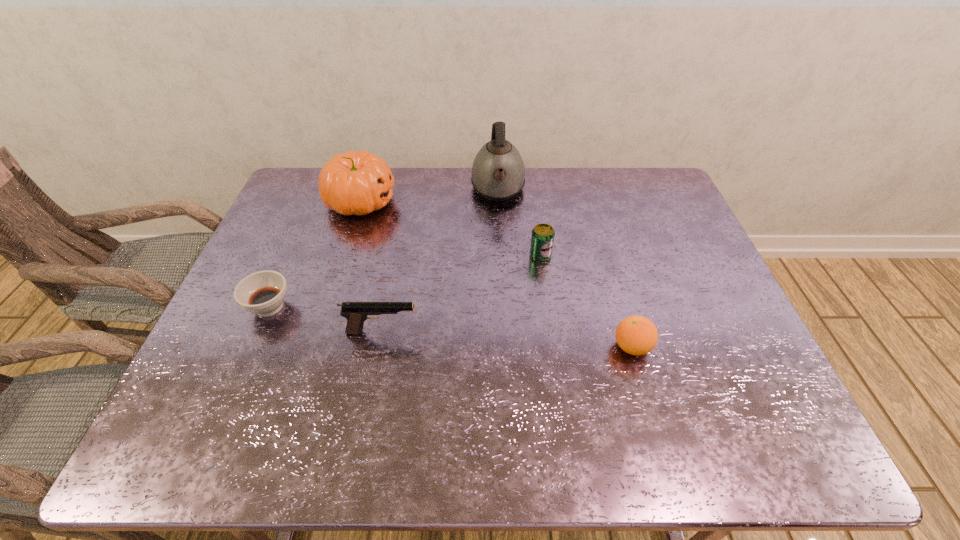
Locate an element on the screen. This screenshot has height=540, width=960. free region located 0.200m on the right of the beer can is located at coordinates (621, 255).

Image resolution: width=960 pixels, height=540 pixels. I want to click on free region located on the front of the rightmost object, so click(661, 450).

Identify the location of free spot located on the back of the shortest object. The height and width of the screenshot is (540, 960). (299, 239).

This screenshot has width=960, height=540. Identify the location of kettle that is at the far edge. (498, 172).

What are the coordinates of `pumpkin that is positioned at the far edge` in the screenshot? It's located at (355, 183).

The width and height of the screenshot is (960, 540). I want to click on pumpkin present at the left edge, so click(355, 183).

Locate an element on the screen. This screenshot has height=540, width=960. soup bowl at the left edge is located at coordinates (263, 293).

Locate an element on the screen. The height and width of the screenshot is (540, 960). object at the far left corner is located at coordinates (355, 183).

What are the coordinates of `vacant space at the far edge of the desktop` in the screenshot? It's located at (576, 195).

In the image, there is a desktop. Identify the location of vacant space at the near edge. (525, 429).